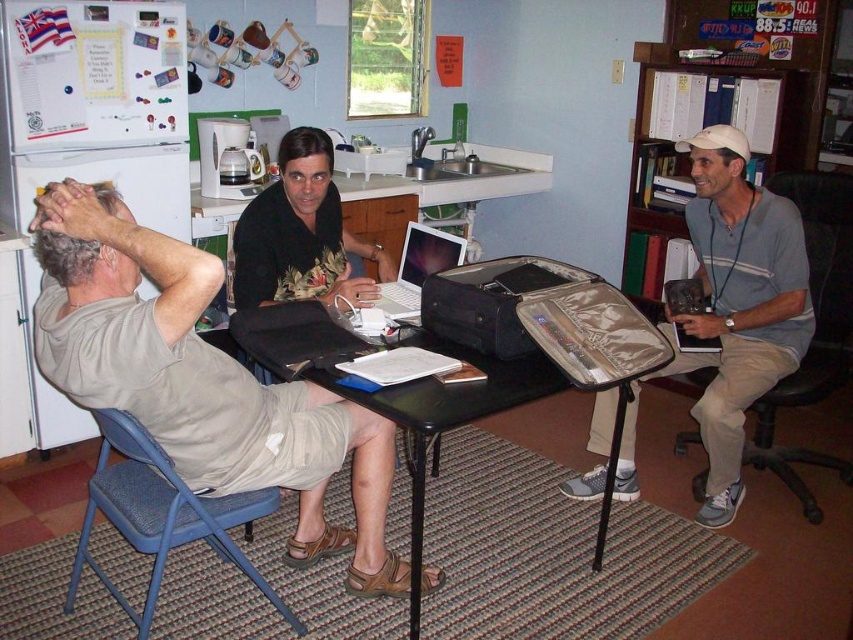
How far apart are gray fabric bag at right and black leather chair at right?

They are 10.85 inches apart.

Measure the distance between point (714,152) and camera.

Point (714,152) is 8.79 feet from camera.

Is point (668, 371) in front of point (772, 186)?

Yes, it is in front of point (772, 186).

You are a GUI agent. You are given a task and a screenshot of the screen. Output one action in this format:
    pyautogui.click(x=<x>, y=<y>)
    Task: Click on the gray fabric bag at right
    
    Given the screenshot: What is the action you would take?
    pyautogui.click(x=738, y=304)

Does gray fabric bag at right come behind blue fabric chair at lower left?

Yes, it is behind blue fabric chair at lower left.

Is gray fabric bag at right closer to camera compared to blue fabric chair at lower left?

No, it is not.

What are the coordinates of `gray fabric bag at right` in the screenshot? It's located at (738, 304).

Who is more distant from viewer, (149, 241) or (445, 253)?

Positioned behind is point (445, 253).

Measure the distance between light brown leather sandal at lower center and silver metallic laptop at center.

They are 29.23 inches apart.

The width and height of the screenshot is (853, 640). What are the coordinates of `light brown leather sandal at lower center` in the screenshot? It's located at (200, 380).